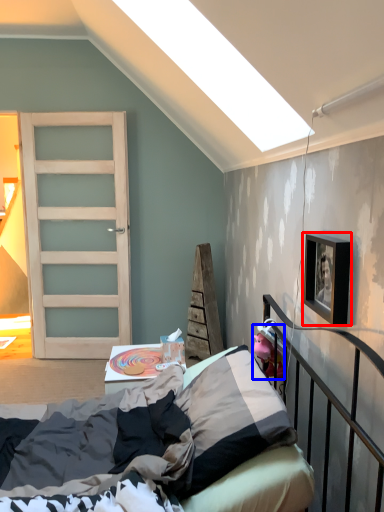
Question: Which object appears farthest to the camera in this image, picture frame (highlighted by a red box) or toy (highlighted by a blue box)?

Choices:
 (A) picture frame
 (B) toy

Answer: (B)